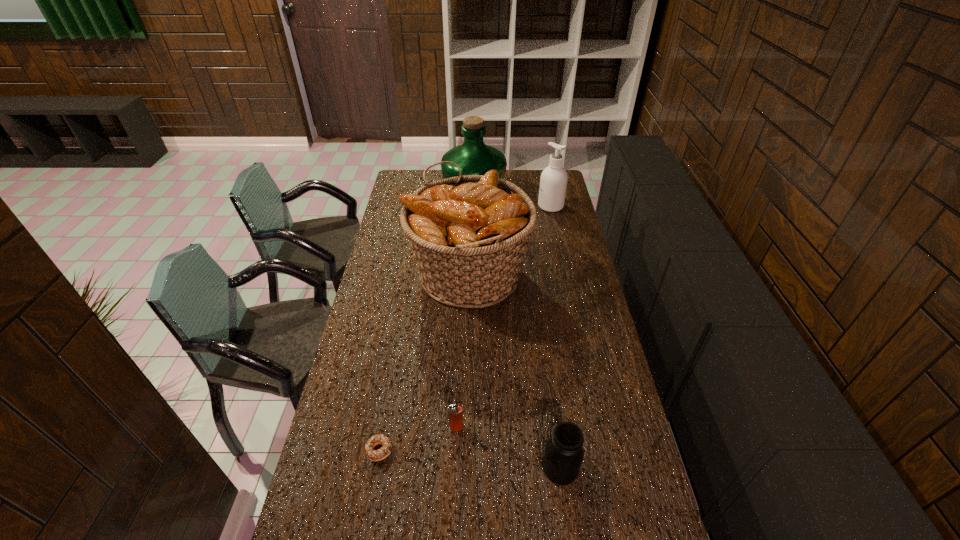
Locate an element on the screen. The height and width of the screenshot is (540, 960). vacant area situated on the front label of the rightmost object is located at coordinates (515, 206).

The width and height of the screenshot is (960, 540). Find the location of `blank area located 0.280m on the front label of the rightmost object`. blank area located 0.280m on the front label of the rightmost object is located at coordinates (483, 206).

You are a GUI agent. You are given a task and a screenshot of the screen. Output one action in this format:
    pyautogui.click(x=<x>, y=<y>)
    Task: Click on the free space located on the front label of the rightmost object
    
    Given the screenshot: What is the action you would take?
    click(520, 206)

Where is `free location located on the left of the fourth tallest object`? The image size is (960, 540). free location located on the left of the fourth tallest object is located at coordinates (507, 468).

The image size is (960, 540). I want to click on vacant region located on the front of the second shortest object, so click(455, 447).

Identify the location of free spot located 0.070m on the front of the doughnut. The height and width of the screenshot is (540, 960). (372, 489).

Image resolution: width=960 pixels, height=540 pixels. Find the location of `object located at the far edge`. object located at the far edge is located at coordinates (474, 157).

Find the location of a particular element. The width and height of the screenshot is (960, 540). basket situated at the left edge is located at coordinates (469, 233).

You are a GUI agent. You are given a task and a screenshot of the screen. Output one action in this format:
    pyautogui.click(x=<x>, y=<y>)
    Task: Click on the doughnut located at the left edge
    This screenshot has height=540, width=960.
    Given the screenshot: What is the action you would take?
    pyautogui.click(x=374, y=455)

The width and height of the screenshot is (960, 540). I want to click on object positioned at the right edge, so click(553, 183).